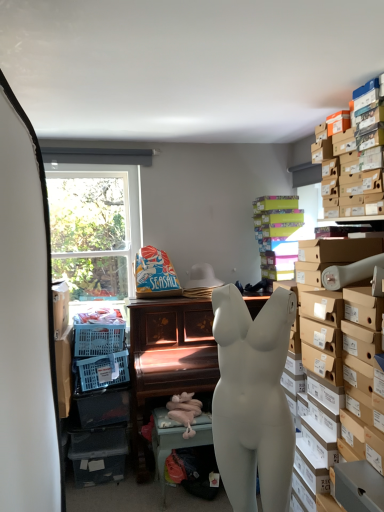
Question: Does brown cardboard boxes at upper right, which is the second shelf from back to front, have a lesser height compared to wooden piano at center, which is the 2th table from front to back?

Choices:
 (A) no
 (B) yes

Answer: (B)

Question: Considering the relative sizes of brown cardboard boxes at upper right, which is the second shelf from back to front, and wooden piano at center, which is the 2th table from front to back, in the image provided, is brown cardboard boxes at upper right, which is the second shelf from back to front, thinner than wooden piano at center, which is the 2th table from front to back,?

Choices:
 (A) yes
 (B) no

Answer: (A)

Question: Is brown cardboard boxes at upper right, which is the first shelf in front-to-back order, placed right next to wooden piano at center, which is the 2th table from front to back?

Choices:
 (A) yes
 (B) no

Answer: (B)

Question: Is the position of brown cardboard boxes at upper right, which is the first shelf in front-to-back order, less distant than that of wooden piano at center, the first table viewed from the back?

Choices:
 (A) no
 (B) yes

Answer: (B)

Question: Would you say brown cardboard boxes at upper right, which is the first shelf in front-to-back order, is outside wooden piano at center, the first table viewed from the back?

Choices:
 (A) yes
 (B) no

Answer: (A)

Question: Relative to pink fabric toy at lower center, the 2th toy from the top, is white matte table at lower center, positioned as the first table in front-to-back order, in front or behind?

Choices:
 (A) behind
 (B) front

Answer: (A)

Question: Considering the positions of point (162, 486) and point (193, 401), is point (162, 486) closer or farther from the camera than point (193, 401)?

Choices:
 (A) farther
 (B) closer

Answer: (A)

Question: In terms of size, does white matte table at lower center, acting as the 2th table starting from the back, appear bigger or smaller than pink fabric toy at lower center, the first toy in the bottom-to-top sequence?

Choices:
 (A) big
 (B) small

Answer: (A)

Question: From the image's perspective, is white matte table at lower center, acting as the 2th table starting from the back, located above or below pink fabric toy at lower center, the 1th toy positioned from the front?

Choices:
 (A) below
 (B) above

Answer: (A)

Question: Is wooden piano at center, which is the 2th table from front to back, taller or shorter than white matte mannequin torso at center?

Choices:
 (A) tall
 (B) short

Answer: (A)

Question: Considering the positions of point (145, 302) and point (225, 316), is point (145, 302) closer or farther from the camera than point (225, 316)?

Choices:
 (A) farther
 (B) closer

Answer: (A)

Question: Choose the correct answer: Is wooden piano at center, which is the 2th table from front to back, inside white matte mannequin torso at center or outside it?

Choices:
 (A) inside
 (B) outside

Answer: (B)

Question: In terms of width, does wooden piano at center, the first table viewed from the back, look wider or thinner when compared to white matte mannequin torso at center?

Choices:
 (A) thin
 (B) wide

Answer: (B)

Question: Considering their positions, is seaside-themed paper bag at center, placed as the 1th toy when sorted from top to bottom, located in front of or behind pink fabric toy at lower center, positioned as the second toy in back-to-front order?

Choices:
 (A) behind
 (B) front

Answer: (A)

Question: From a real-world perspective, is seaside-themed paper bag at center, placed as the 1th toy when sorted from top to bottom, positioned above or below pink fabric toy at lower center, the first toy in the bottom-to-top sequence?

Choices:
 (A) above
 (B) below

Answer: (A)